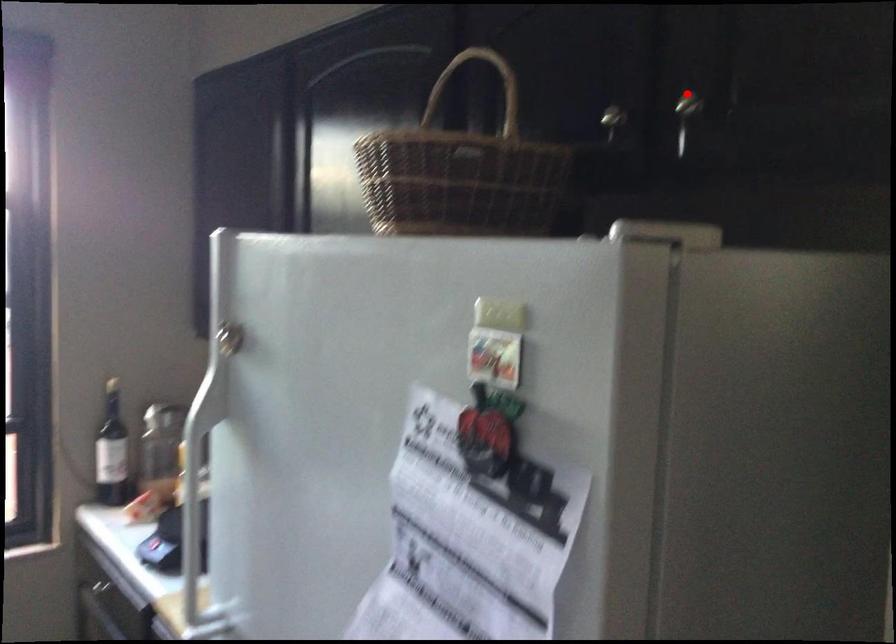
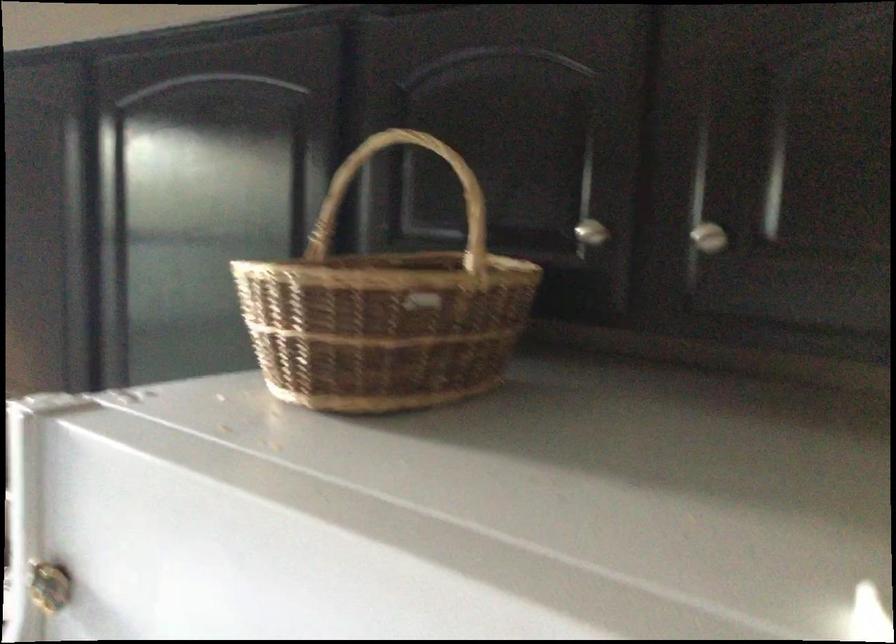
Find the pixel in the second image that matches the highlighted location in the first image.

(709, 238)